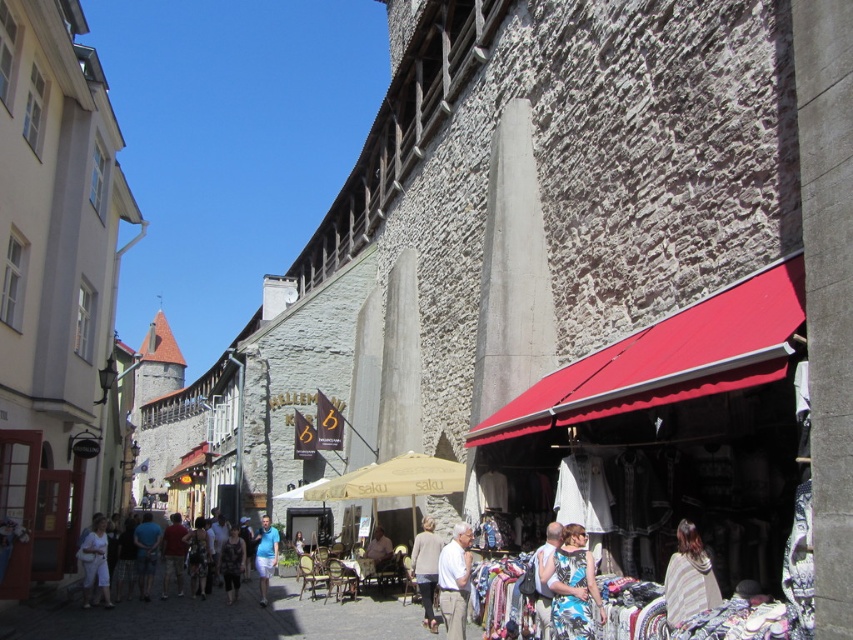
You are a tourist walking down the street and want to take a photo of both the red fabric awning at center and the white cotton shirt at center. Which object should you focus on first if you want to include both in the same frame without zooming in or out?

You should focus on the red fabric awning at center first because it is larger in size than the white cotton shirt at center, so you can position it in the frame first and then adjust to include the smaller shirt.

Consider the image. You are standing in the historic town square of Tallinn, Estonia. You see a large stone wall on your right and a red fabric awning at center. Based on their 2D positions in the image, which object is closer to the center of the image?

The red fabric awning at center is exactly at the center of the image, so it is closer to the center than the large stone wall on the right.